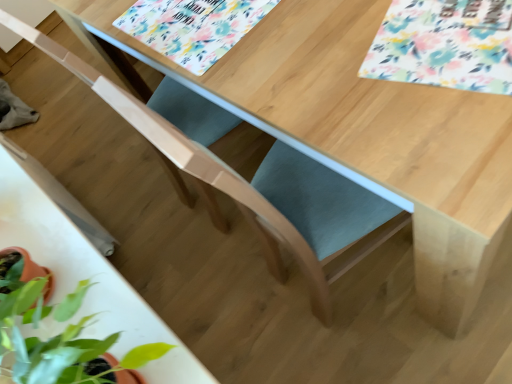
Where is `unoccupied area in front of floral-patterned placemat at upper center, which appears as the first flower when viewed from the back`? unoccupied area in front of floral-patterned placemat at upper center, which appears as the first flower when viewed from the back is located at coordinates (294, 53).